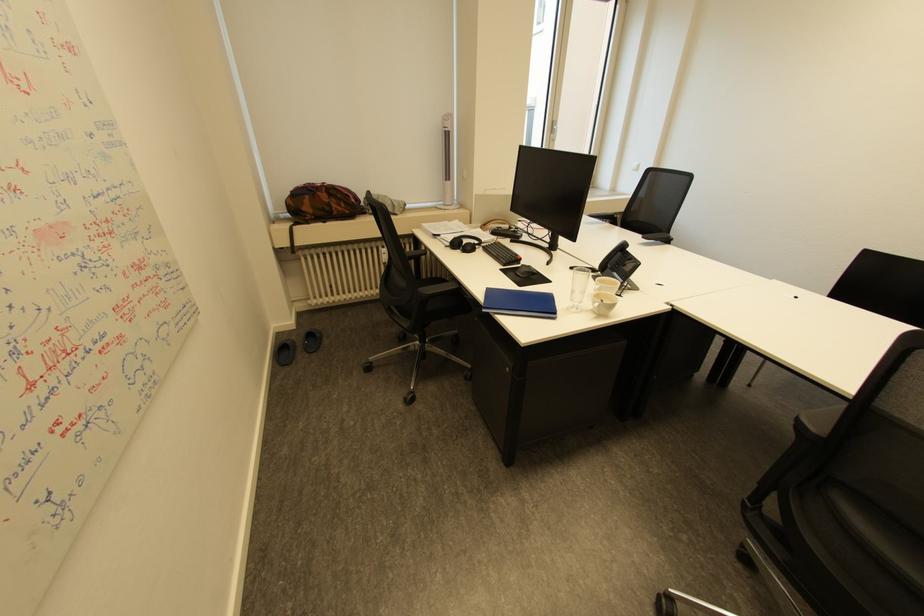
Find where to lift the telephone handset. Please return your answer as a coordinate pair (x, y).

(623, 265)